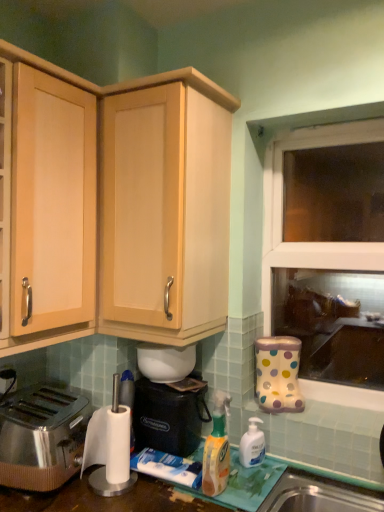
The height and width of the screenshot is (512, 384). Identify the location of vacant point to the right of translucent plastic spray bottle at lower center, which is counted as the first bottle, starting from the front. (250, 484).